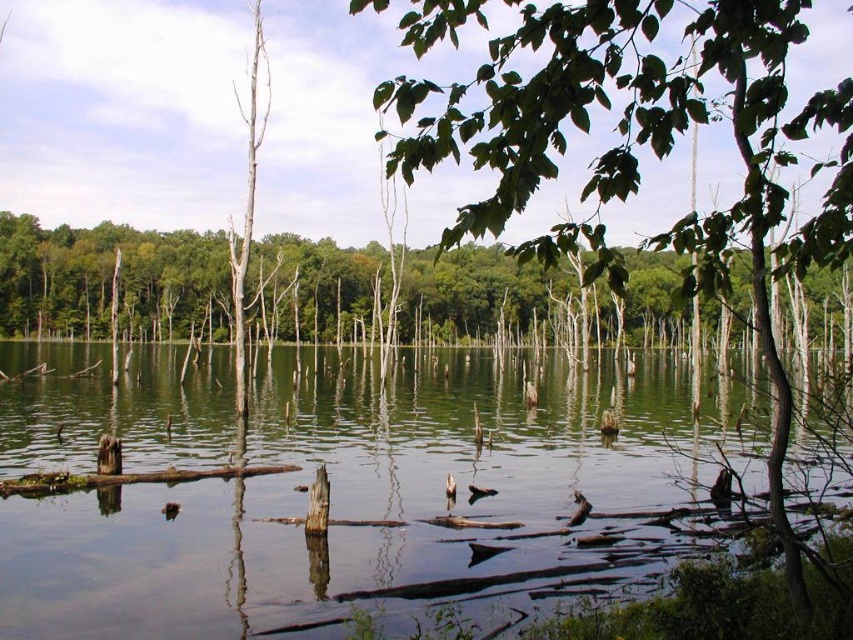
Question: Can you confirm if green reflective water at center is positioned to the right of green leafy tree at upper center?

Choices:
 (A) yes
 (B) no

Answer: (B)

Question: Estimate the real-world distances between objects in this image. Which object is farther from the green reflective water at center?

Choices:
 (A) green matte tree at center
 (B) green leafy tree at upper center

Answer: (A)

Question: Is green leafy tree at upper center smaller than green matte tree at center?

Choices:
 (A) yes
 (B) no

Answer: (B)

Question: Can you confirm if green reflective water at center is smaller than green leafy tree at upper center?

Choices:
 (A) yes
 (B) no

Answer: (A)

Question: Which point appears farthest from the camera in this image?

Choices:
 (A) click(242, 492)
 (B) click(73, 257)

Answer: (B)

Question: Which object is positioned farthest from the green reflective water at center?

Choices:
 (A) green leafy tree at upper center
 (B) green matte tree at center

Answer: (B)